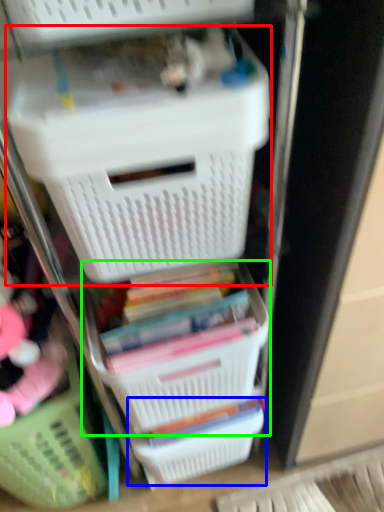
Question: Which is nearer to the storage box (highlighted by a red box)? basket (highlighted by a blue box) or basket (highlighted by a green box).

Choices:
 (A) basket
 (B) basket

Answer: (B)